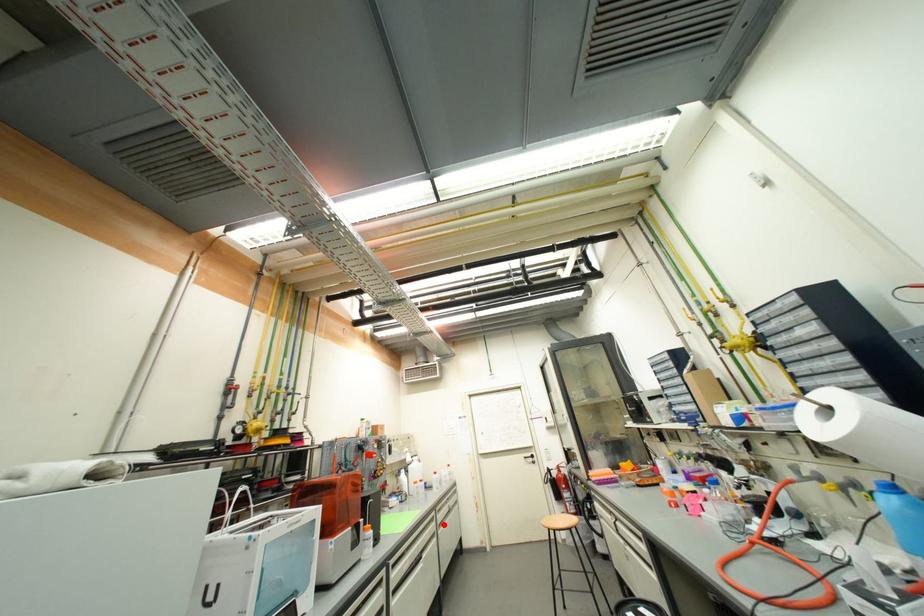
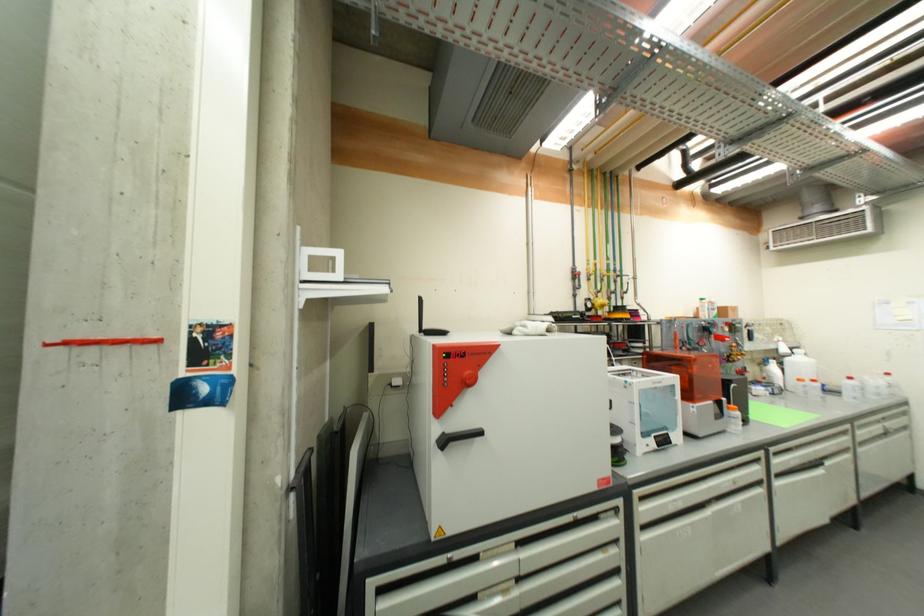
In the second image, find the point that corresponds to the highlighted location in the first image.

(864, 442)